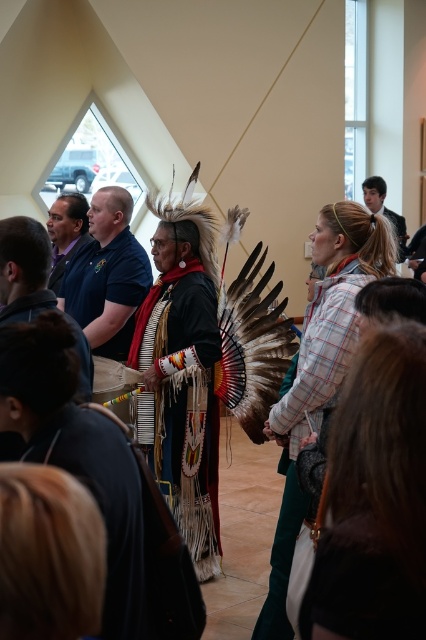
You are organizing a photo shoot and need to ensure that the dark blue shirt at center and the matte black shirt at upper right are visible in the frame. Based on their sizes, which shirt should you prioritize positioning closer to the camera to ensure it doesn not get obscured by the other?

The dark blue shirt at center should be positioned closer to the camera since it is wider than the matte black shirt at upper right, ensuring it remains visible and not obscured.

You are a photographer standing at the back of the room. You want to take a photo that includes both the dark blue shirt at center and the matte black shirt at left. The minimum distance between the shirts for your camera lens to focus on both is 1.5 meters. Will you be able to capture both in focus?

The dark blue shirt at center and the matte black shirt at left are 1.39 meters apart from each other. Since the required minimum distance is 1.5 meters, the camera lens cannot focus on both shirts simultaneously as the distance is insufficient.